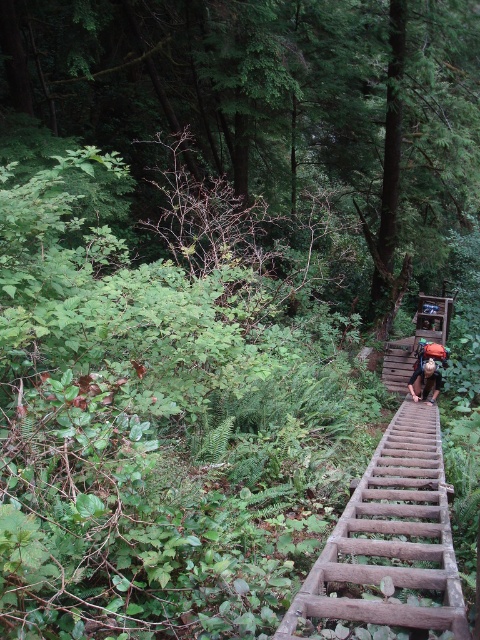
Who is higher up, green leafy tree at upper center or camouflage fabric backpack at center?

green leafy tree at upper center is above.

This screenshot has height=640, width=480. I want to click on green leafy tree at upper center, so click(274, 104).

Where is `green leafy tree at upper center`? green leafy tree at upper center is located at coordinates (274, 104).